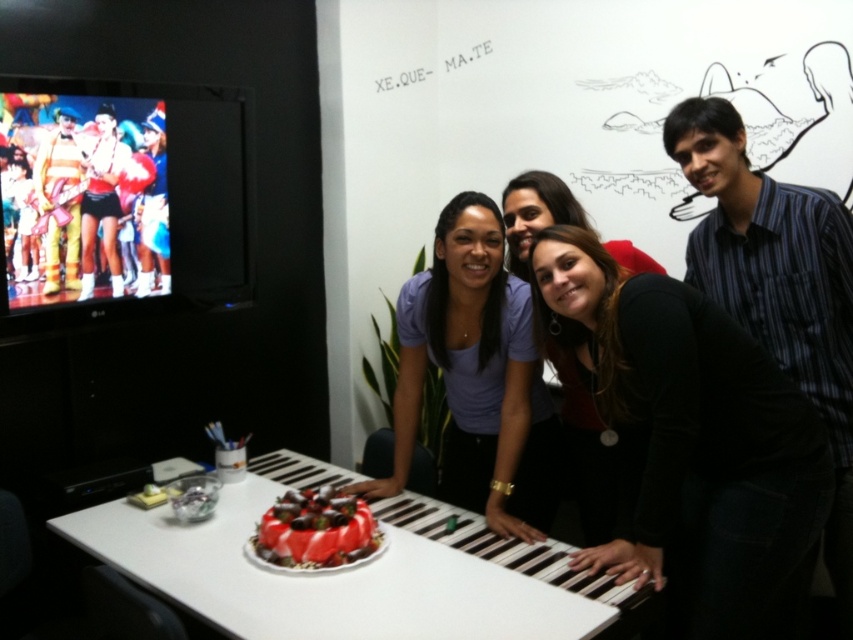
Question: Among these points, which one is nearest to the camera?

Choices:
 (A) (496, 376)
 (B) (682, 156)
 (C) (431, 525)
 (D) (309, 506)

Answer: (D)

Question: Which object is positioned closest to the black matte piano keys at center?

Choices:
 (A) smooth glossy red cake at center
 (B) striped cotton shirt at right
 (C) purple matte shirt at center

Answer: (C)

Question: Is white plastic table at center to the right of purple matte shirt at center from the viewer's perspective?

Choices:
 (A) yes
 (B) no

Answer: (B)

Question: Is white plastic table at center below purple matte shirt at center?

Choices:
 (A) no
 (B) yes

Answer: (B)

Question: Can you confirm if white plastic table at center is smaller than smooth glossy red cake at center?

Choices:
 (A) yes
 (B) no

Answer: (B)

Question: Estimate the real-world distances between objects in this image. Which object is farther from the white plastic table at center?

Choices:
 (A) purple matte shirt at center
 (B) striped cotton shirt at right
 (C) smooth glossy red cake at center

Answer: (B)